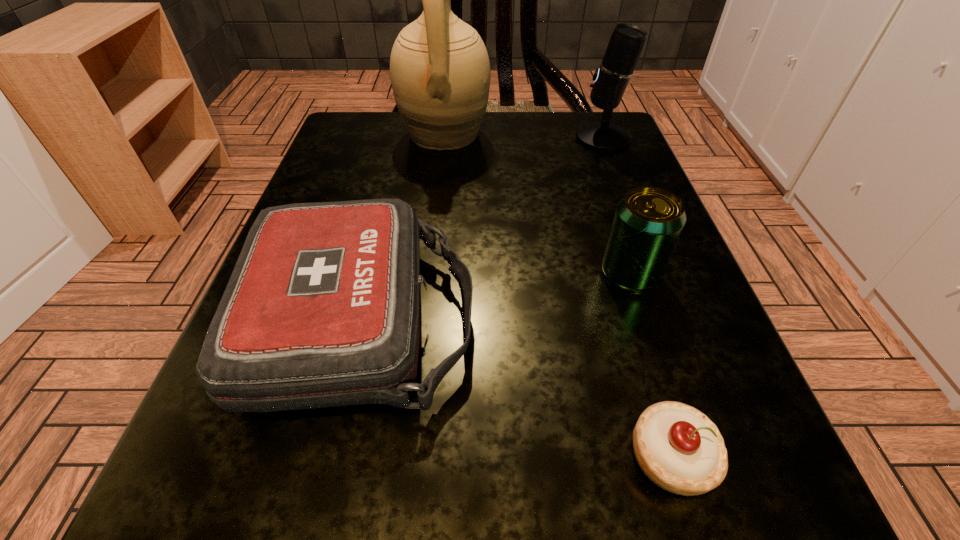
Locate an element on the screen. The image size is (960, 540). object situated at the near right corner is located at coordinates (679, 448).

The height and width of the screenshot is (540, 960). Identify the location of blank space at the far edge of the desktop. (524, 124).

The width and height of the screenshot is (960, 540). Identify the location of free region at the near edge of the desktop. (370, 536).

Find the location of a particular element. The height and width of the screenshot is (540, 960). vacant space at the left edge of the desktop is located at coordinates (316, 193).

In the image, there is a desktop. Where is `blank space at the right edge`? The height and width of the screenshot is (540, 960). blank space at the right edge is located at coordinates (655, 342).

Locate an element on the screen. The image size is (960, 540). blank space at the near left corner of the desktop is located at coordinates (269, 490).

This screenshot has height=540, width=960. I want to click on vacant space at the far right corner of the desktop, so click(x=595, y=155).

You are a GUI agent. You are given a task and a screenshot of the screen. Output one action in this format:
    pyautogui.click(x=<x>, y=<y>)
    Task: Click on the free spot between the shortest object and the fourth shortest object
    The height and width of the screenshot is (540, 960).
    Given the screenshot: What is the action you would take?
    pyautogui.click(x=636, y=298)

At what (x,y) coordinates should I click in order to perform the action: click on free area in between the tallest object and the third tallest object. Please return your answer as a coordinate pair (x, y). The width and height of the screenshot is (960, 540). Looking at the image, I should click on (538, 205).

Find the location of a particular element. free point between the microphone and the pastry is located at coordinates (636, 298).